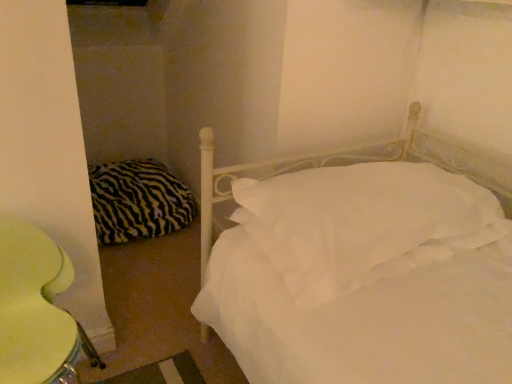
Question: Is zebra-patterned fabric pillow at left, the 1th pillow positioned from the left, at the right side of yellow fabric swivel chair at lower left?

Choices:
 (A) yes
 (B) no

Answer: (B)

Question: Is zebra-patterned fabric pillow at left, the 1th pillow positioned from the left, not within yellow fabric swivel chair at lower left?

Choices:
 (A) yes
 (B) no

Answer: (A)

Question: Is zebra-patterned fabric pillow at left, placed as the second pillow when sorted from right to left, smaller than yellow fabric swivel chair at lower left?

Choices:
 (A) yes
 (B) no

Answer: (B)

Question: Can you confirm if zebra-patterned fabric pillow at left, the 1th pillow from the back, is bigger than yellow fabric swivel chair at lower left?

Choices:
 (A) yes
 (B) no

Answer: (A)

Question: Is zebra-patterned fabric pillow at left, the 1th pillow from the back, taller or shorter than yellow fabric swivel chair at lower left?

Choices:
 (A) short
 (B) tall

Answer: (A)

Question: Is zebra-patterned fabric pillow at left, the 1th pillow from the back, inside or outside of yellow fabric swivel chair at lower left?

Choices:
 (A) outside
 (B) inside

Answer: (A)

Question: From a real-world perspective, relative to yellow fabric swivel chair at lower left, is zebra-patterned fabric pillow at left, placed as the second pillow when sorted from right to left, vertically above or below?

Choices:
 (A) below
 (B) above

Answer: (A)

Question: In terms of size, does zebra-patterned fabric pillow at left, the 1th pillow from the back, appear bigger or smaller than yellow fabric swivel chair at lower left?

Choices:
 (A) small
 (B) big

Answer: (B)

Question: Is point (354, 221) positioned closer to the camera than point (29, 292)?

Choices:
 (A) farther
 (B) closer

Answer: (B)

Question: Is white soft pillow at center, positioned as the 1th pillow in right-to-left order, to the left or to the right of yellow fabric swivel chair at lower left in the image?

Choices:
 (A) left
 (B) right

Answer: (B)

Question: From their relative heights in the image, would you say white soft pillow at center, which is counted as the 2th pillow, starting from the back, is taller or shorter than yellow fabric swivel chair at lower left?

Choices:
 (A) tall
 (B) short

Answer: (B)

Question: From a real-world perspective, is white soft pillow at center, which is counted as the 2th pillow, starting from the back, positioned above or below yellow fabric swivel chair at lower left?

Choices:
 (A) above
 (B) below

Answer: (A)

Question: Based on their sizes in the image, would you say yellow fabric swivel chair at lower left is bigger or smaller than white soft pillow at center, positioned as the 1th pillow in right-to-left order?

Choices:
 (A) big
 (B) small

Answer: (B)

Question: Is yellow fabric swivel chair at lower left to the left or to the right of white soft pillow at center, which is counted as the 1th pillow, starting from the front, in the image?

Choices:
 (A) right
 (B) left

Answer: (B)